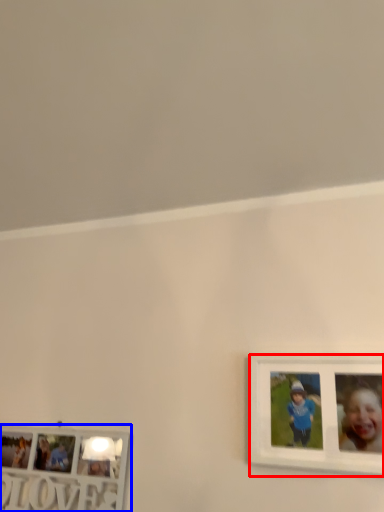
Question: Among these objects, which one is farthest to the camera, picture frame (highlighted by a red box) or picture frame (highlighted by a blue box)?

Choices:
 (A) picture frame
 (B) picture frame

Answer: (B)